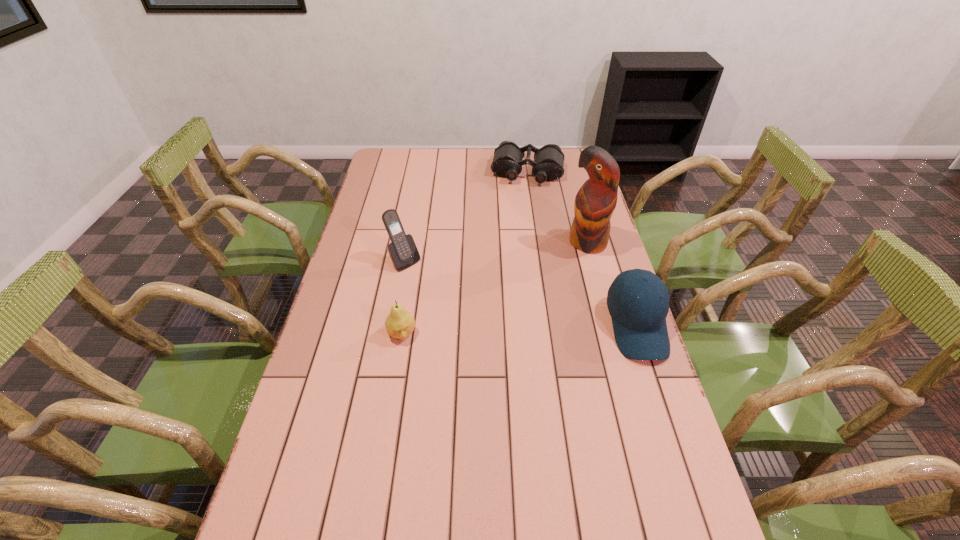
Locate an element on the screen. Image resolution: width=960 pixels, height=540 pixels. free space between the baseball cap and the pear is located at coordinates (519, 330).

Identify the location of free space between the second tallest object and the pear. The image size is (960, 540). (403, 298).

Locate an element on the screen. Image resolution: width=960 pixels, height=540 pixels. free area in between the pear and the baseball cap is located at coordinates (519, 330).

Identify which object is the closest to the second tallest object. Please provide its 2D coordinates. Your answer should be formatted as a tuple, i.e. [(x, y)], where the tuple contains the x and y coordinates of a point satisfying the conditions above.

[(399, 324)]

Identify which object is the third closest to the fourth shortest object. Please provide its 2D coordinates. Your answer should be formatted as a tuple, i.e. [(x, y)], where the tuple contains the x and y coordinates of a point satisfying the conditions above.

[(595, 202)]

Locate an element on the screen. Image resolution: width=960 pixels, height=540 pixels. vacant area in the image that satisfies the following two spatial constraints: 1. on the front side of the shortest object; 2. on the right side of the tallest object is located at coordinates (538, 242).